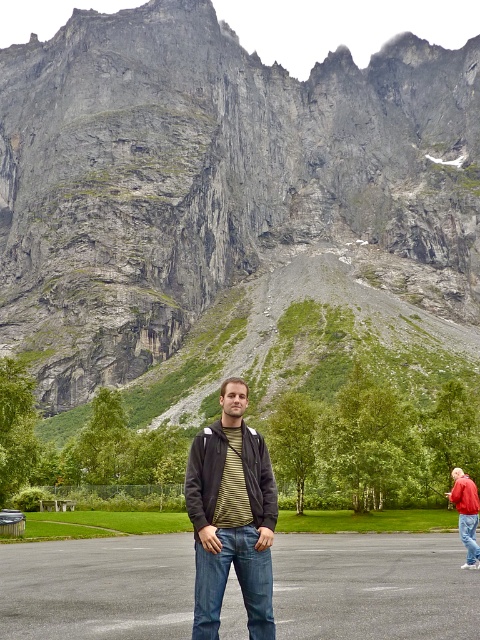
Question: Is striped knit sweater at center to the left of red leather jacket at lower right from the viewer's perspective?

Choices:
 (A) yes
 (B) no

Answer: (A)

Question: Can you confirm if rugged granite mountain at upper center is bigger than striped knit sweater at center?

Choices:
 (A) yes
 (B) no

Answer: (A)

Question: Does rugged granite mountain at upper center appear on the right side of blue denim jeans at center?

Choices:
 (A) no
 (B) yes

Answer: (A)

Question: Among these points, which one is farthest from the camera?

Choices:
 (A) (263, 600)
 (B) (58, 163)

Answer: (B)

Question: Which is nearer to the striped knit sweater at center?

Choices:
 (A) rugged granite mountain at upper center
 (B) red leather jacket at lower right

Answer: (B)

Question: Which point is closer to the camera?

Choices:
 (A) (26, 48)
 (B) (38, 636)

Answer: (B)